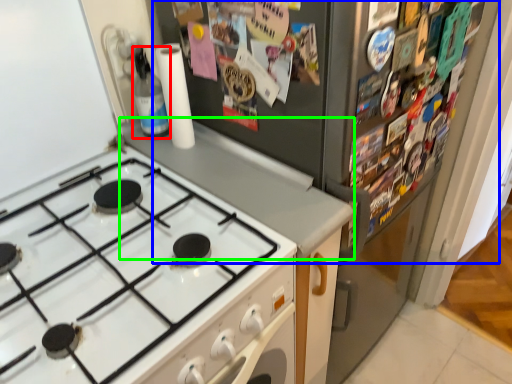
Question: Considering the real-world distances, which object is farthest from bottle (highlighted by a red box)? fridge (highlighted by a blue box) or counter top (highlighted by a green box)?

Choices:
 (A) fridge
 (B) counter top

Answer: (A)